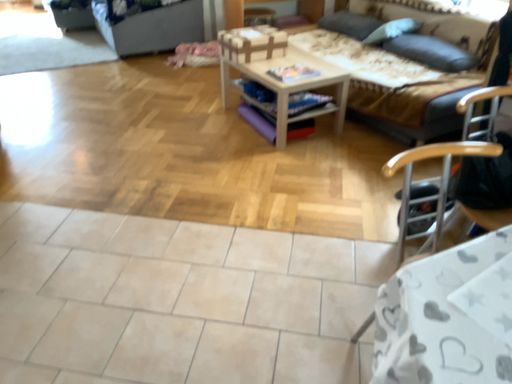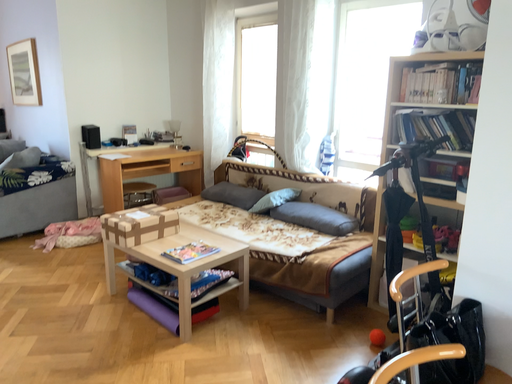
Question: Which way did the camera rotate in the video?

Choices:
 (A) rotated downward
 (B) rotated upward

Answer: (B)